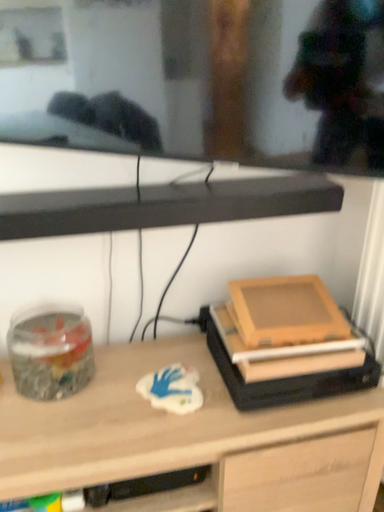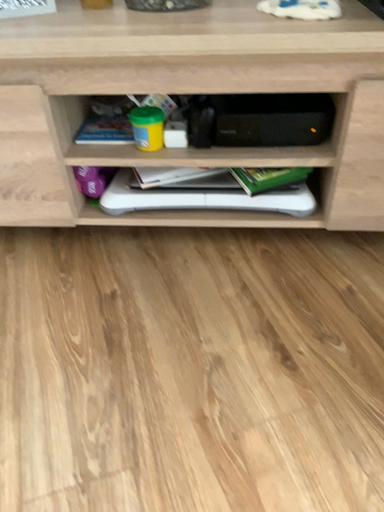
Question: How did the camera likely rotate when shooting the video?

Choices:
 (A) rotated downward
 (B) rotated upward

Answer: (A)